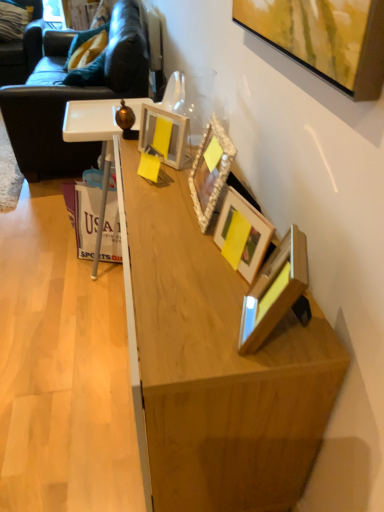
This screenshot has height=512, width=384. I want to click on vacant space situated on the left part of wooden picture frame at lower right, which appears as the fourth picture frame when viewed from the back, so click(x=196, y=324).